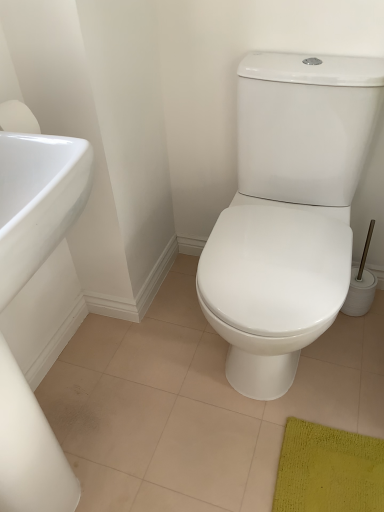
What do you see at coordinates (288, 211) in the screenshot? I see `white glossy toilet at center` at bounding box center [288, 211].

Identify the location of white glossy toilet at center. The height and width of the screenshot is (512, 384). (288, 211).

I want to click on white glossy sink at left, so click(x=37, y=201).

The height and width of the screenshot is (512, 384). What do you see at coordinates (37, 201) in the screenshot? I see `white glossy sink at left` at bounding box center [37, 201].

What is the approximate width of white glossy sink at left?

white glossy sink at left is 44.10 centimeters wide.

This screenshot has width=384, height=512. In order to click on white glossy toilet at center in this screenshot , I will do `click(288, 211)`.

Visually, is white glossy sink at left positioned to the left or to the right of white glossy toilet at center?

In the image, white glossy sink at left appears on the left side of white glossy toilet at center.

Which object is further away from the camera taking this photo, white glossy sink at left or white glossy toilet at center?

white glossy toilet at center is more distant.

Is point (5, 177) closer to viewer compared to point (218, 305)?

Yes.

From the image's perspective, which is above, white glossy sink at left or white glossy toilet at center?

white glossy toilet at center appears higher in the image.

From a real-world perspective, who is located lower, white glossy sink at left or white glossy toilet at center?

white glossy toilet at center, from a real-world perspective.

Which object is thinner, white glossy sink at left or white glossy toilet at center?

Thinner between the two is white glossy sink at left.

Is white glossy sink at left shorter than white glossy toilet at center?

No.

Is white glossy sink at left bigger than white glossy toilet at center?

Actually, white glossy sink at left might be smaller than white glossy toilet at center.

Do you think white glossy sink at left is within white glossy toilet at center, or outside of it?

white glossy sink at left is outside white glossy toilet at center.

Would you consider white glossy sink at left to be distant from white glossy toilet at center?

They are positioned close to each other.

Is white glossy sink at left turned away from white glossy toilet at center?

No.

Locate an element on the screen. The height and width of the screenshot is (512, 384). sink that appears below the white glossy toilet at center (from the image's perspective) is located at coordinates (37, 201).

Visually, is white glossy toilet at center positioned to the left or to the right of white glossy sink at left?

Based on their positions, white glossy toilet at center is located to the right of white glossy sink at left.

Is white glossy toilet at center further to the viewer compared to white glossy sink at left?

Yes, the depth of white glossy toilet at center is greater than that of white glossy sink at left.

Which point is more forward, (272, 92) or (39, 243)?

The point (39, 243) is closer.

From the image's perspective, would you say white glossy toilet at center is shown under white glossy sink at left?

No.

Looking at this image, from a real-world perspective, who is located higher, white glossy toilet at center or white glossy sink at left?

In real-world perspective, white glossy sink at left is above.

Can you confirm if white glossy toilet at center is thinner than white glossy sink at left?

No, white glossy toilet at center is not thinner than white glossy sink at left.

Can you confirm if white glossy toilet at center is shorter than white glossy sink at left?

Correct, white glossy toilet at center is not as tall as white glossy sink at left.

Considering the sizes of objects white glossy toilet at center and white glossy sink at left in the image provided, who is smaller, white glossy toilet at center or white glossy sink at left?

Smaller between the two is white glossy sink at left.

Would you say white glossy sink at left is part of white glossy toilet at center's contents?

No, white glossy sink at left is located outside of white glossy toilet at center.

Is white glossy toilet at center placed right next to white glossy sink at left?

No, white glossy toilet at center is not with white glossy sink at left.

Could you tell me if white glossy toilet at center is facing white glossy sink at left?

No, white glossy toilet at center is not oriented towards white glossy sink at left.

How many degrees apart are the facing directions of white glossy toilet at center and white glossy sink at left?

white glossy toilet at center and white glossy sink at left are facing 89.7 degrees away from each other.

Where is `sink lying in front of the white glossy toilet at center`? The height and width of the screenshot is (512, 384). sink lying in front of the white glossy toilet at center is located at coordinates (37, 201).

Find the location of a particular element. sink lying below the white glossy toilet at center (from the image's perspective) is located at coordinates (37, 201).

This screenshot has height=512, width=384. I want to click on toilet that is under the white glossy sink at left (from a real-world perspective), so click(x=288, y=211).